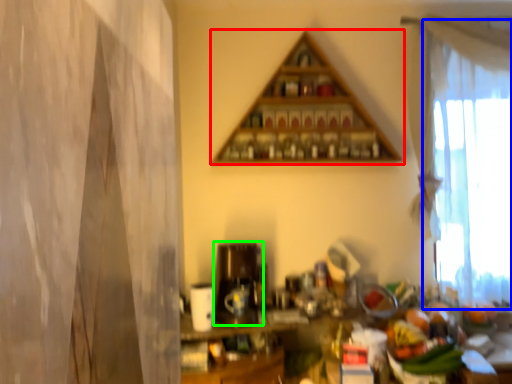
Question: Which object is positioned closest to shelf (highlighted by a red box)? Select from curtain (highlighted by a blue box) and appliance (highlighted by a green box).

Choices:
 (A) curtain
 (B) appliance

Answer: (A)